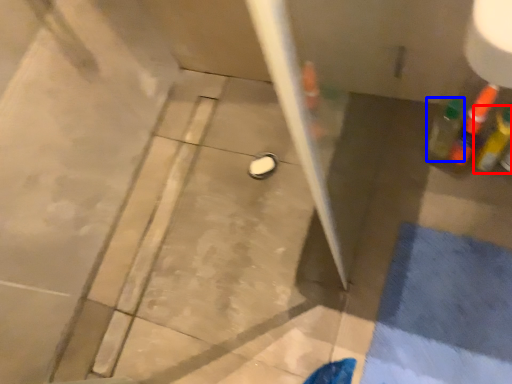
Question: Which object is closer to the camera taking this photo, bottle (highlighted by a red box) or bottle (highlighted by a blue box)?

Choices:
 (A) bottle
 (B) bottle

Answer: (A)